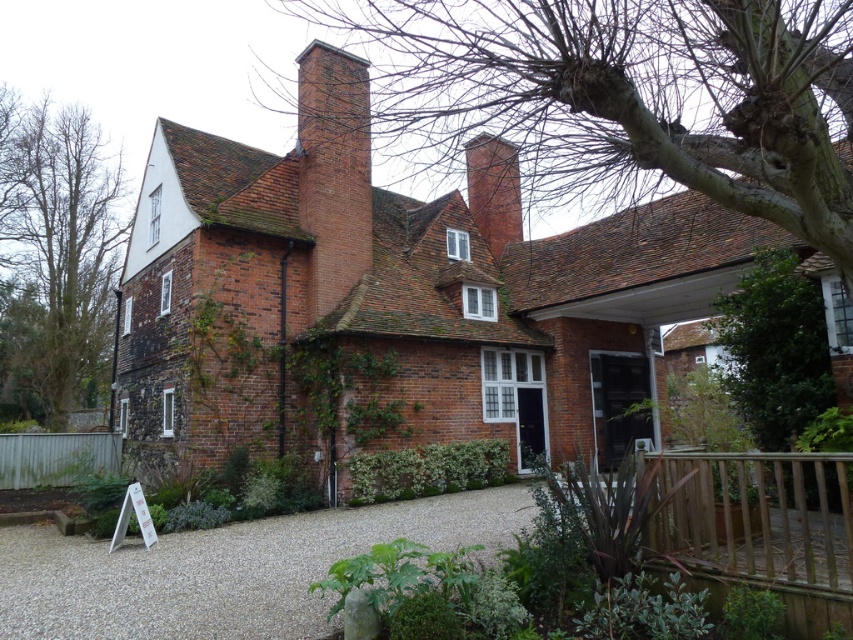
Question: Which of the following is the farthest from the observer?

Choices:
 (A) brick chimney at center
 (B) gray gravel at lower center
 (C) bare branches at upper center

Answer: (A)

Question: Is the position of gray gravel at lower center less distant than that of brown leafless tree at left?

Choices:
 (A) yes
 (B) no

Answer: (A)

Question: Which point appears closest to the camera in this image?

Choices:
 (A) (219, 262)
 (B) (78, 140)

Answer: (A)

Question: Which point appears closest to the camera in this image?

Choices:
 (A) (354, 93)
 (B) (346, 13)
 (C) (505, 211)

Answer: (A)

Question: Can you confirm if bare branches at upper center is bigger than red brick chimney at upper center?

Choices:
 (A) no
 (B) yes

Answer: (B)

Question: Can you confirm if brick house at center is positioned below brick chimney at center?

Choices:
 (A) no
 (B) yes

Answer: (B)